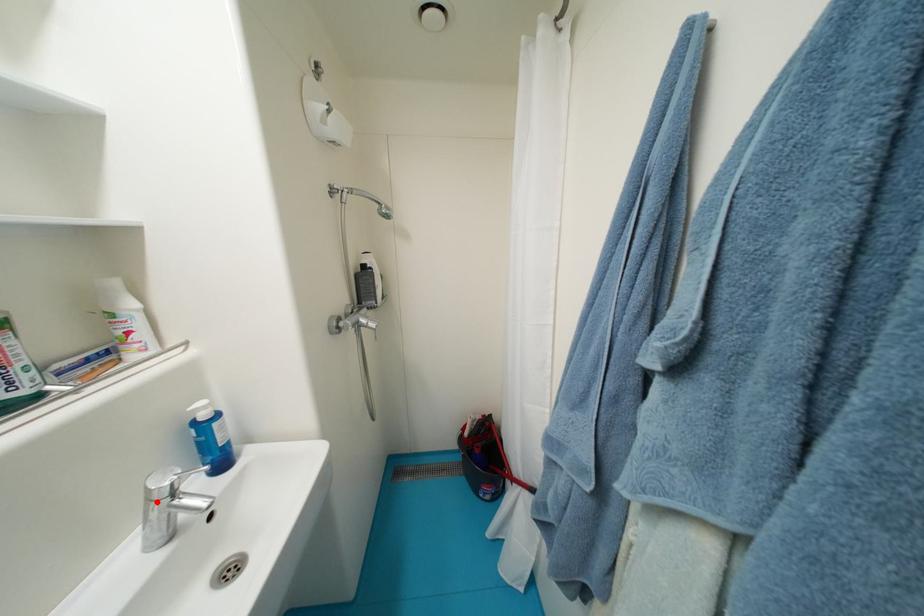
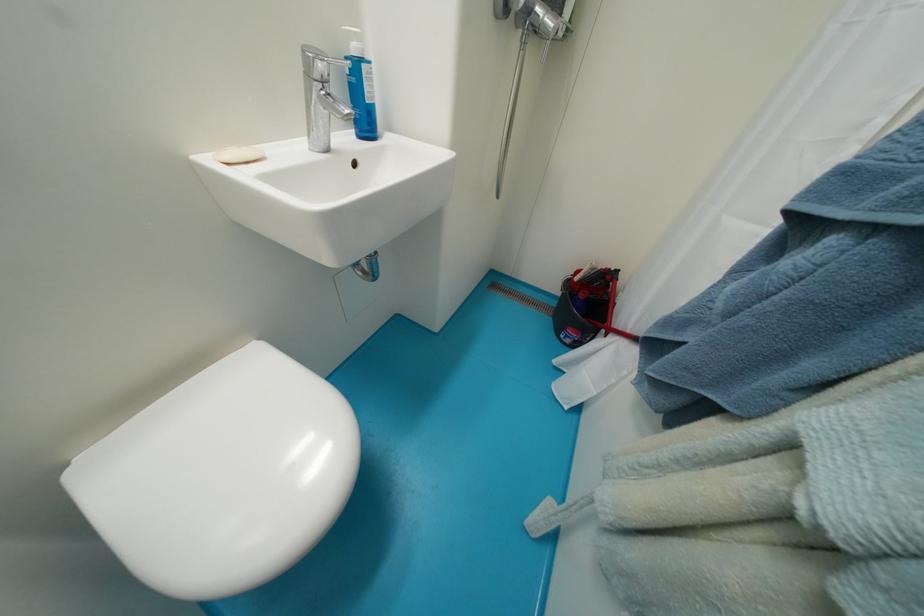
Locate, in the second image, the point that corresponds to the highlighted location in the first image.

(313, 78)